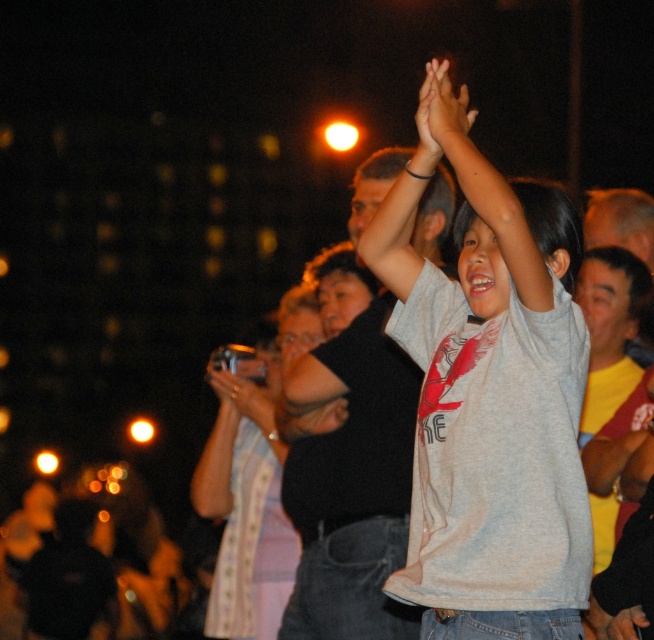
Question: Which object is the farthest from the gray matte shirt at center?

Choices:
 (A) metallic silver camera at center
 (B) smooth skin hands at upper center

Answer: (A)

Question: Which of the following is the closest to the observer?

Choices:
 (A) (226, 371)
 (B) (449, 96)
 (C) (407, 280)

Answer: (B)

Question: Does smooth skin hands at upper center come in front of metallic silver camera at center?

Choices:
 (A) yes
 (B) no

Answer: (A)

Question: Which point is farther to the camera?

Choices:
 (A) (271, 410)
 (B) (576, 620)
 (C) (421, 109)

Answer: (A)

Question: Is the position of gray matte shirt at center less distant than that of metallic silver camera at center?

Choices:
 (A) no
 (B) yes

Answer: (B)

Question: Is smooth skin hands at upper center further to the viewer compared to metallic silver camera at center?

Choices:
 (A) yes
 (B) no

Answer: (B)